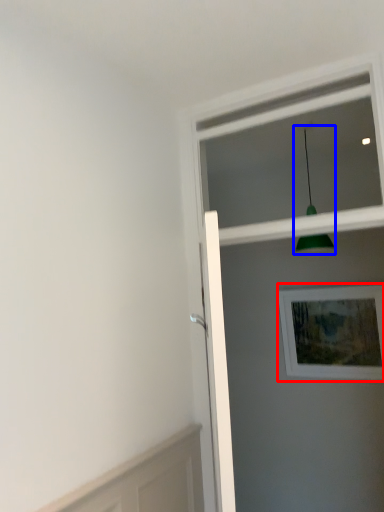
Question: Which object appears closest to the camera in this image, picture frame (highlighted by a red box) or light fixture (highlighted by a blue box)?

Choices:
 (A) picture frame
 (B) light fixture

Answer: (B)